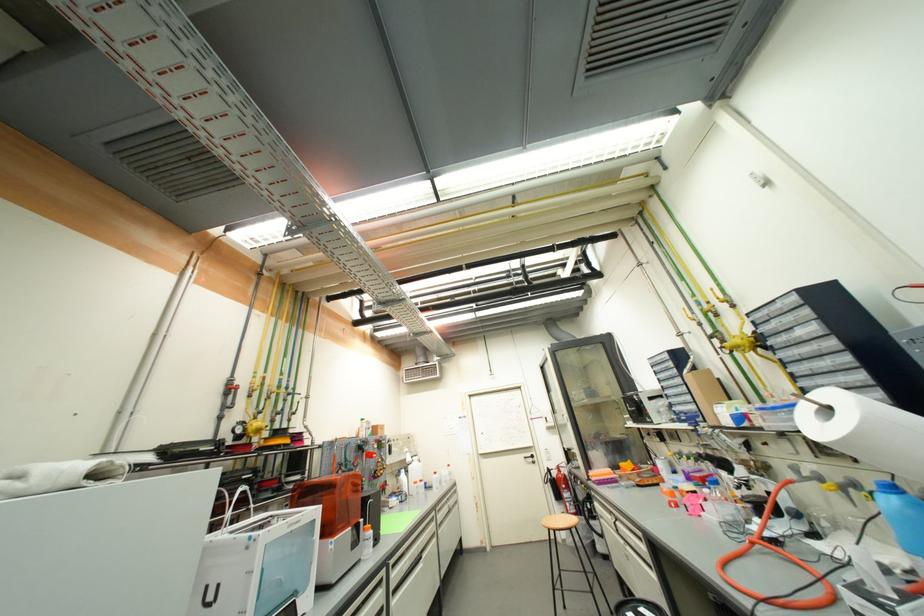
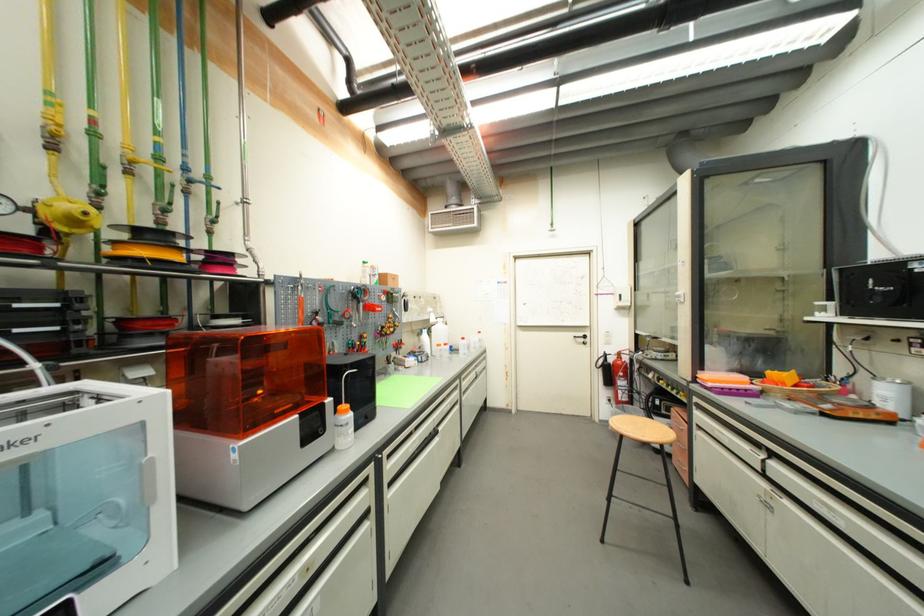
Where in the second image is the point corresponding to the point at 350,446 from the first image?

(334, 289)